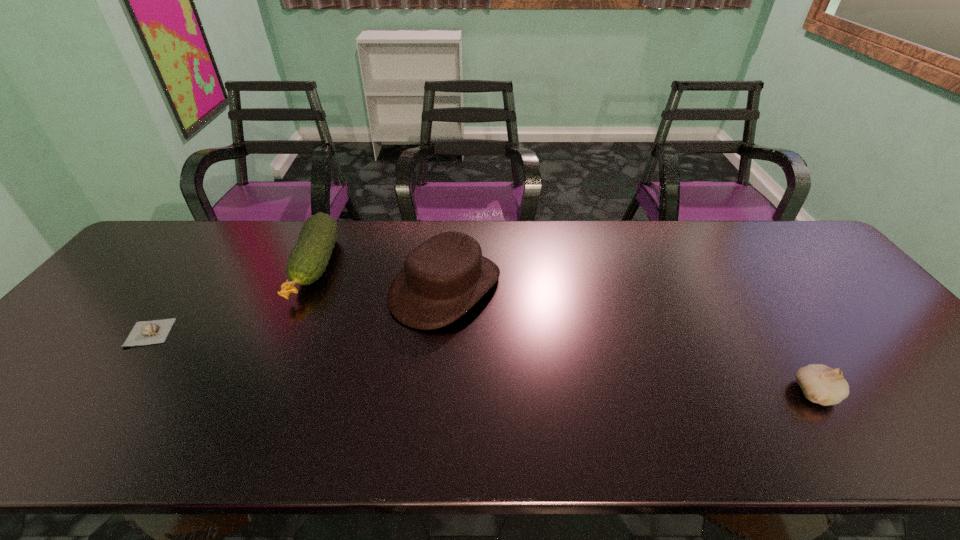
Identify the location of free space located 0.250m on the front of the shorter garlic. (66, 445).

This screenshot has height=540, width=960. I want to click on hat present at the far edge, so click(444, 277).

This screenshot has height=540, width=960. Find the location of `cucumber that is positioned at the far edge`. cucumber that is positioned at the far edge is located at coordinates (308, 260).

You are a GUI agent. You are given a task and a screenshot of the screen. Output one action in this format:
    pyautogui.click(x=<x>, y=<y>)
    Task: Click on the object that is positioned at the left edge
    The height and width of the screenshot is (540, 960).
    Given the screenshot: What is the action you would take?
    pyautogui.click(x=150, y=332)

Find the location of a particular element. Image resolution: width=960 pixels, height=540 pixels. vacant space at the far edge of the desktop is located at coordinates (708, 248).

Identify the location of blank space at the near edge of the desktop. (752, 419).

Where is `vacant space at the left edge of the desktop`? The image size is (960, 540). vacant space at the left edge of the desktop is located at coordinates (113, 293).

In the image, there is a desktop. Identify the location of vacant space at the right edge. [x=913, y=386].

I want to click on free space at the far right corner, so click(775, 222).

What are the coordinates of `empty space between the rightmost object and the cucumber` in the screenshot? It's located at (565, 329).